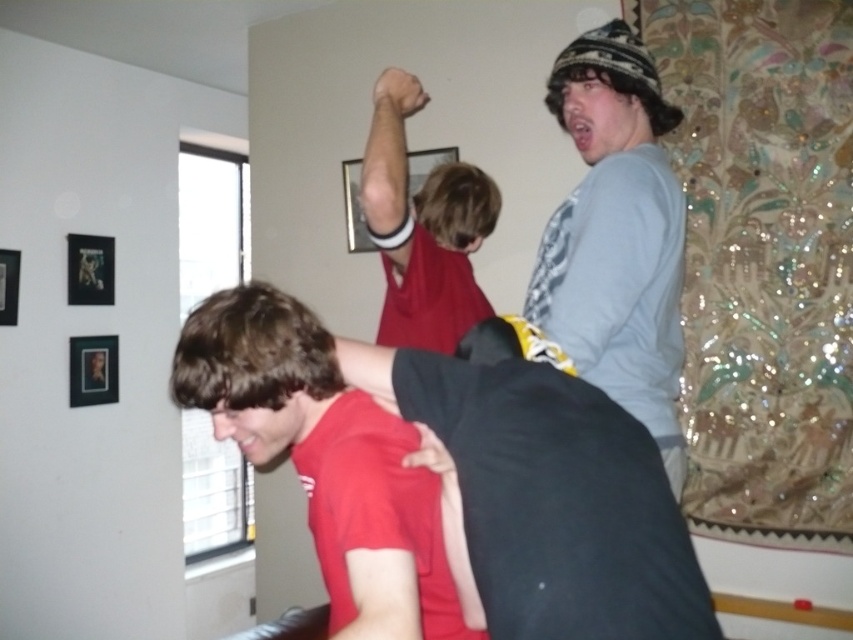
Question: Which object is the farthest from the metallic black picture frame at upper left?

Choices:
 (A) metallic gold picture frame at upper left
 (B) gray matte shirt at upper right

Answer: (B)

Question: Which of the following is the closest to the observer?

Choices:
 (A) metallic black picture frame at upper left
 (B) metallic gold picture frame at upper left
 (C) matte plastic picture frame at upper center

Answer: (C)

Question: Among these points, which one is nearest to the camera?

Choices:
 (A) (71, 284)
 (B) (10, 307)

Answer: (B)

Question: Does matte plastic picture frame at upper center appear on the right side of brushed metal picture frame at upper left?

Choices:
 (A) no
 (B) yes

Answer: (B)

Question: Is red matte shirt at lower left smaller than metallic gold picture frame at upper left?

Choices:
 (A) yes
 (B) no

Answer: (B)

Question: Is metallic gold picture frame at upper left below metallic black picture frame at upper left?

Choices:
 (A) no
 (B) yes

Answer: (B)